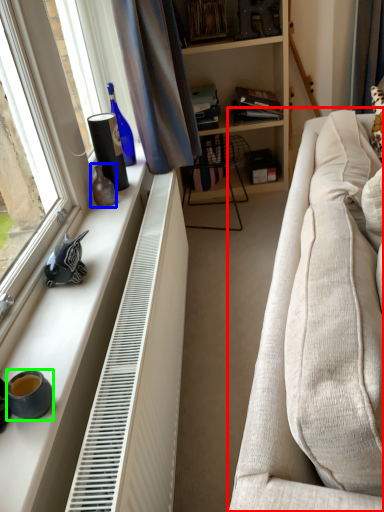
Question: Which is nearer to the studio couch (highlighted by a red box)? vase (highlighted by a blue box) or coffee cup (highlighted by a green box).

Choices:
 (A) vase
 (B) coffee cup

Answer: (B)